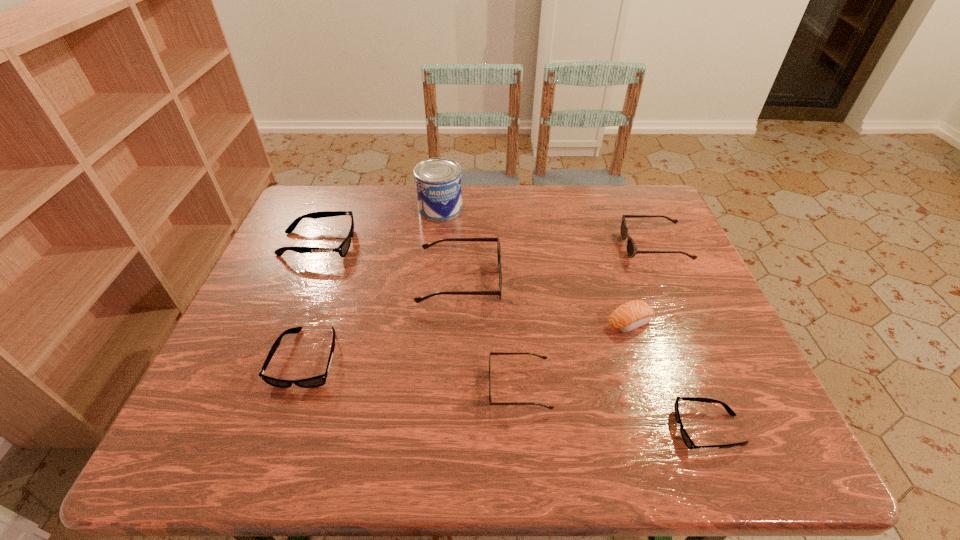
The height and width of the screenshot is (540, 960). Identify the location of the shortest object. (689, 443).

Identify the location of free space located 0.200m on the front label of the blue can. The width and height of the screenshot is (960, 540). (434, 266).

The height and width of the screenshot is (540, 960). I want to click on vacant space located 0.240m on the front lenses of the seventh shortest object, so click(593, 282).

Where is `free location located on the front lenses of the second biggest brown sunglasses`? free location located on the front lenses of the second biggest brown sunglasses is located at coordinates (603, 247).

At what (x,y) coordinates should I click in order to perform the action: click on vacant space located on the front lenses of the second biggest brown sunglasses. Please return your answer as a coordinate pair (x, y). Looking at the image, I should click on (549, 247).

You are a GUI agent. You are given a task and a screenshot of the screen. Output one action in this format:
    pyautogui.click(x=<x>, y=<y>)
    Task: Click on the vacant space located 0.070m on the front lenses of the second biggest brown sunglasses
    This screenshot has height=540, width=960.
    Given the screenshot: What is the action you would take?
    pyautogui.click(x=599, y=247)

The width and height of the screenshot is (960, 540). In order to click on free space located on the front-facing side of the farthest black sunglasses in this screenshot , I will do point(465,244).

The width and height of the screenshot is (960, 540). What are the coordinates of `vacant space located on the back of the sushi` in the screenshot? It's located at (615, 278).

Where is `vacant space located 0.110m on the front-facing side of the second nearest black sunglasses`? vacant space located 0.110m on the front-facing side of the second nearest black sunglasses is located at coordinates (278, 444).

Where is `free space located 0.050m on the front lenses of the smallest brown sunglasses`? The image size is (960, 540). free space located 0.050m on the front lenses of the smallest brown sunglasses is located at coordinates (465, 387).